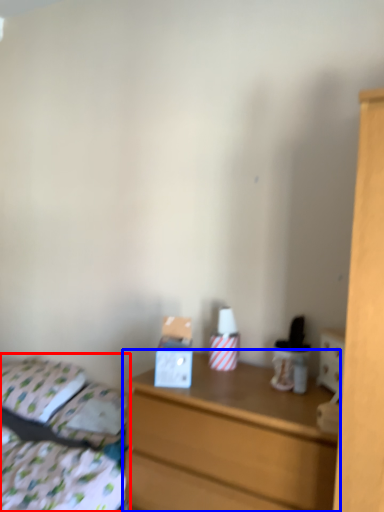
Question: Which of the following is the closest to the observer, bed (highlighted by a red box) or chest of drawers (highlighted by a blue box)?

Choices:
 (A) bed
 (B) chest of drawers

Answer: (A)